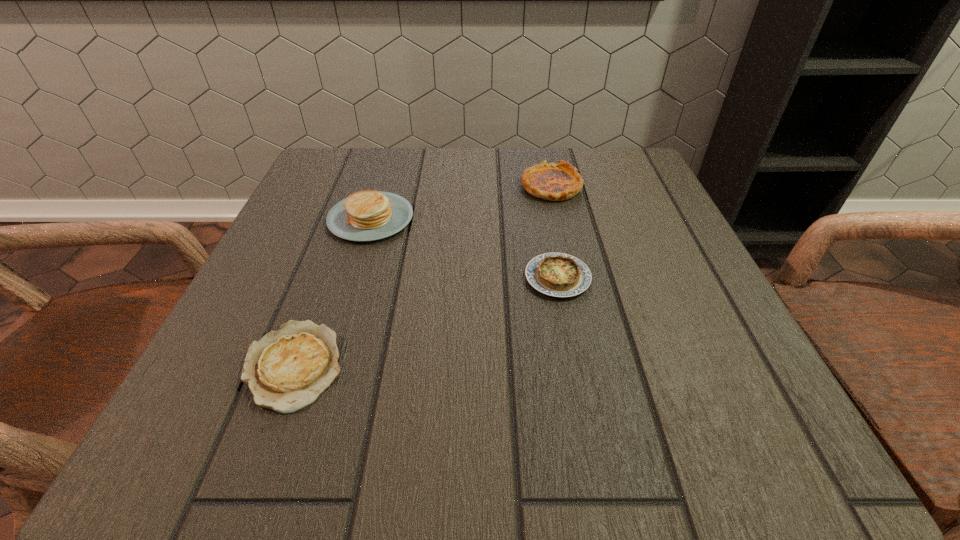
Identify the location of vacant area that satisfies the following two spatial constraints: 1. on the front side of the second nearest object; 2. on the right side of the pancake. (352, 278).

Find the location of a particular element. The width and height of the screenshot is (960, 540). free spot that satisfies the following two spatial constraints: 1. on the back side of the farthest quiche; 2. on the right side of the nearest object is located at coordinates (360, 186).

Image resolution: width=960 pixels, height=540 pixels. In order to click on free location that satisfies the following two spatial constraints: 1. on the back side of the nearest quiche; 2. on the right side of the third shortest object in this screenshot , I will do `click(360, 186)`.

Find the location of a particular element. The height and width of the screenshot is (540, 960). vacant region that satisfies the following two spatial constraints: 1. on the back side of the third shortest object; 2. on the left side of the shortest object is located at coordinates (360, 186).